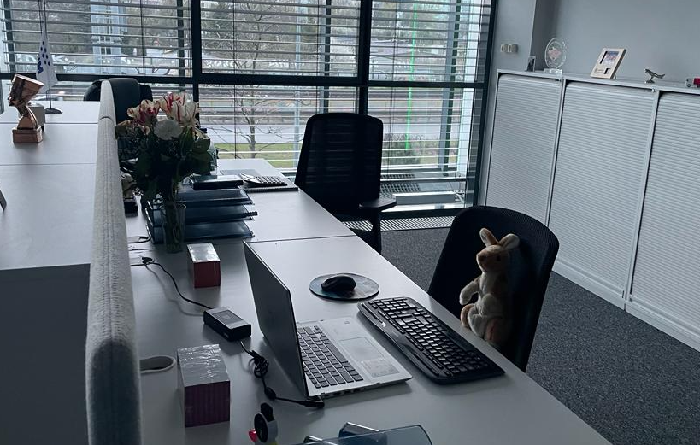
In order to click on 1 calculator in this screenshot , I will do `click(262, 175)`.